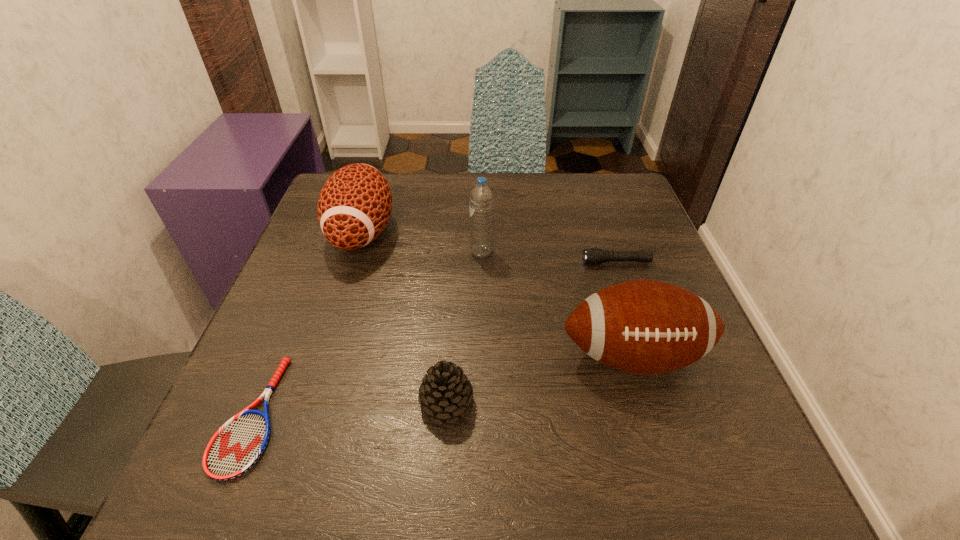
Where is `water bottle`? The height and width of the screenshot is (540, 960). water bottle is located at coordinates (481, 200).

Where is `the farther football`? This screenshot has height=540, width=960. the farther football is located at coordinates (354, 206).

Locate an element on the screen. The width and height of the screenshot is (960, 540). the right football is located at coordinates (647, 327).

Find the location of a particular element. pinecone is located at coordinates click(445, 393).

Find the location of a particular element. flashlight is located at coordinates (593, 256).

In order to click on the shortest object in this screenshot , I will do `click(238, 444)`.

Find the location of a particular element. This screenshot has width=960, height=540. free spot located on the left of the tallest object is located at coordinates pos(398,253).

You are a GUI agent. You are given a task and a screenshot of the screen. Output one action in this format:
    pyautogui.click(x=<x>, y=<y>)
    Task: Click on the free space located 0.200m on the front of the left football
    
    Given the screenshot: What is the action you would take?
    pyautogui.click(x=325, y=348)

You are a GUI agent. You are given a task and a screenshot of the screen. Output one action in this format:
    pyautogui.click(x=<x>, y=<y>)
    Task: Click on the vacant space located 0.160m on the laces of the nearer football
    This screenshot has width=960, height=540.
    Given the screenshot: What is the action you would take?
    pyautogui.click(x=677, y=496)

Locate an element on the screen. This screenshot has height=540, width=960. vacant point located at the narrow end of the fourth tallest object is located at coordinates point(579,402).